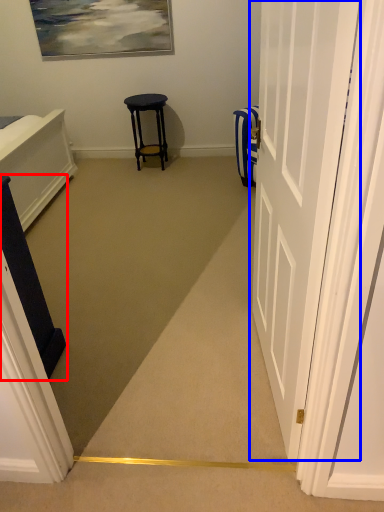
Question: Which object appears closest to the camera in this image, furniture (highlighted by a red box) or door (highlighted by a blue box)?

Choices:
 (A) furniture
 (B) door

Answer: (B)